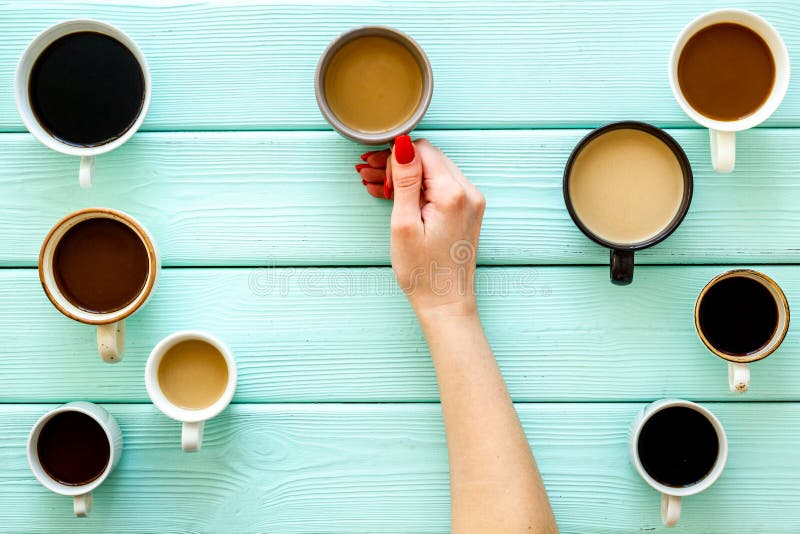
You are a GUI agent. You are given a task and a screenshot of the screen. Output one action in this format:
    pyautogui.click(x=<x>, y=<y>)
    Task: Click on the blue wooden slats
    
    Given the screenshot: What is the action you would take?
    pyautogui.click(x=518, y=76), pyautogui.click(x=544, y=238), pyautogui.click(x=542, y=370), pyautogui.click(x=564, y=477)